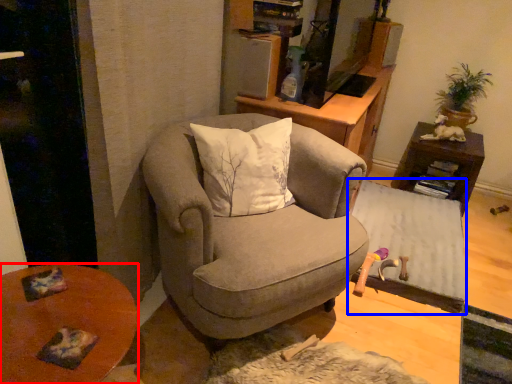
Question: Among these objects, which one is nearest to the camera, desk (highlighted by a red box) or table (highlighted by a blue box)?

Choices:
 (A) desk
 (B) table

Answer: (A)